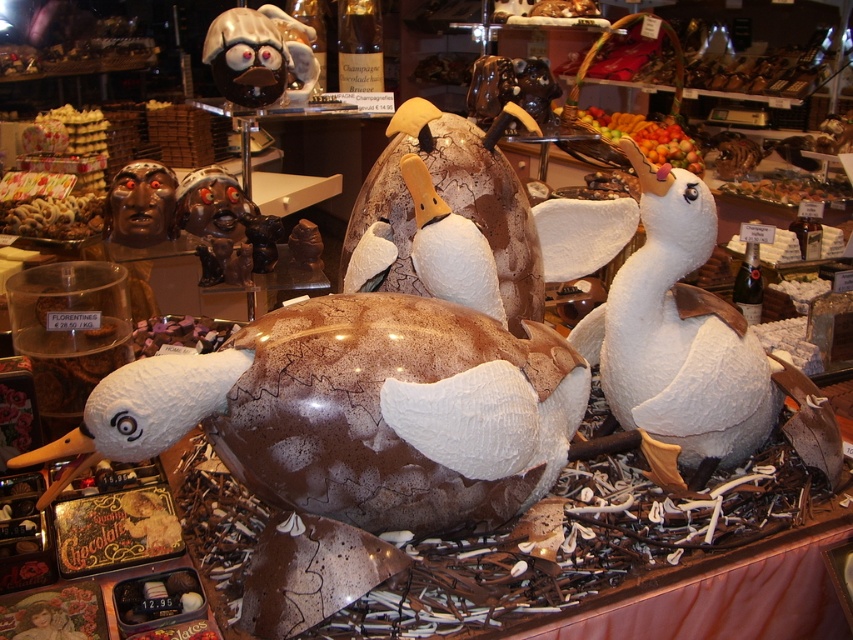
Can you confirm if white matte duckling at center is taller than shiny chocolate figurine at upper center?

Indeed, white matte duckling at center has a greater height compared to shiny chocolate figurine at upper center.

At what (x,y) coordinates should I click in order to perform the action: click on white matte duckling at center. Please return your answer as a coordinate pair (x, y). Looking at the image, I should click on (677, 336).

The width and height of the screenshot is (853, 640). I want to click on white matte duckling at center, so click(x=677, y=336).